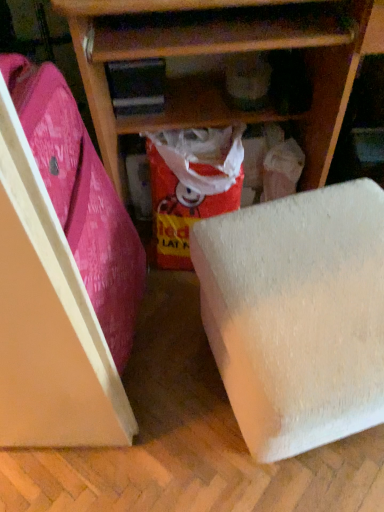
Identify the location of vacant area that is situated to the right of pink fabric suitcase at left. coord(177,352).